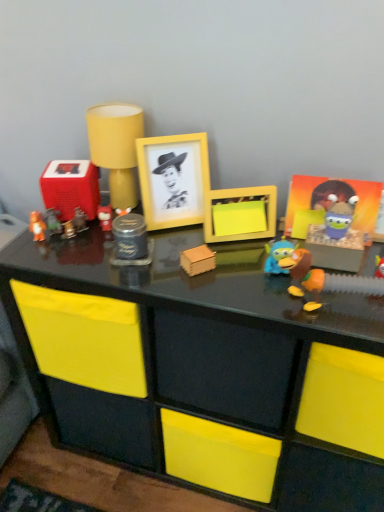
In order to click on free space on the front side of blue rubber duck at center, which is counted as the eleventh toy, starting from the left in this screenshot , I will do `click(297, 311)`.